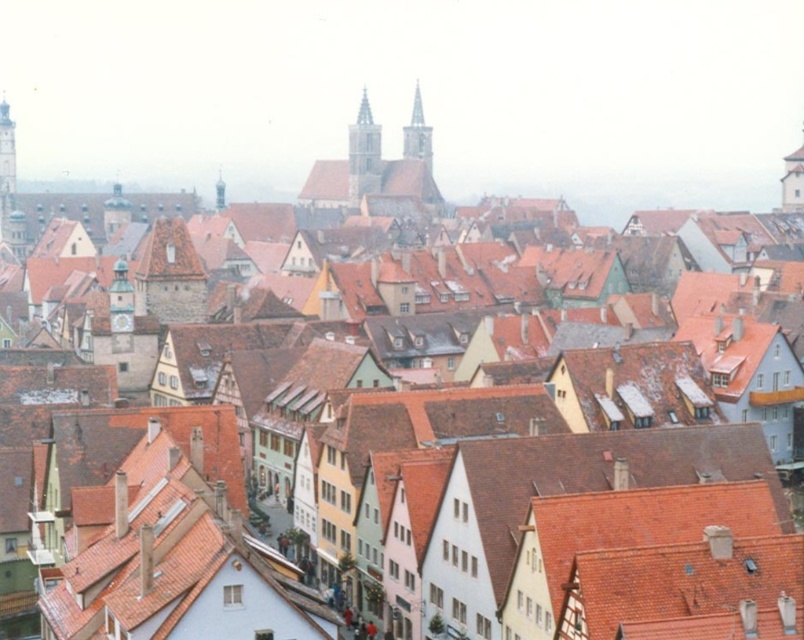
Is the position of smooth stone tower at left more distant than that of smooth gray steeple at center?

No, smooth stone tower at left is in front of smooth gray steeple at center.

Does smooth stone tower at left have a smaller size compared to smooth gray steeple at center?

Actually, smooth stone tower at left might be larger than smooth gray steeple at center.

At what (x,y) coordinates should I click in order to perform the action: click on smooth stone tower at left. Please return your answer as a coordinate pair (x, y). The width and height of the screenshot is (804, 640). Looking at the image, I should click on (6, 168).

In order to click on smooth stone tower at left in this screenshot , I will do `click(6, 168)`.

Describe the element at coordinates (363, 154) in the screenshot. Image resolution: width=804 pixels, height=640 pixels. I see `smooth stone tower at center` at that location.

Is the position of smooth stone tower at center more distant than that of smooth gray steeple at center?

No, it is in front of smooth gray steeple at center.

Between point (355, 177) and point (413, 156), which one is positioned in front?

Point (355, 177) is in front.

The width and height of the screenshot is (804, 640). I want to click on smooth stone tower at center, so click(x=363, y=154).

Who is higher up, smooth stone tower at center or smooth stone tower at left?

Positioned higher is smooth stone tower at center.

Who is more forward, [347,179] or [9,157]?

Point [9,157] is in front.

This screenshot has height=640, width=804. Identify the location of smooth stone tower at center. (363, 154).